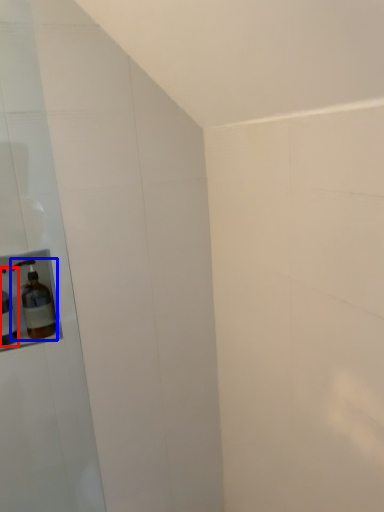
Question: Which point is closer to the camera, bottle (highlighted by a red box) or bottle (highlighted by a blue box)?

Choices:
 (A) bottle
 (B) bottle

Answer: (A)